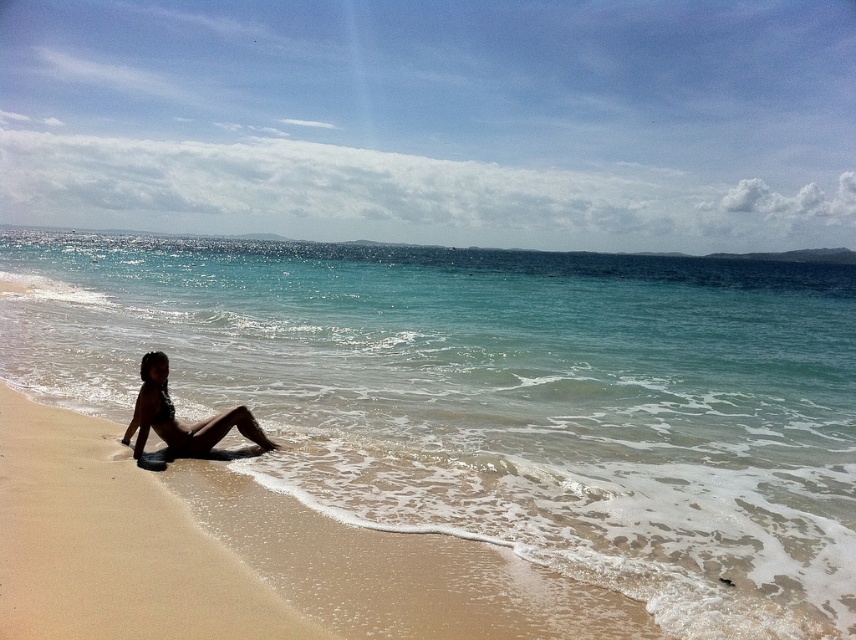
You are standing on the beach and want to place a small towel between the beige sand at lower left and the matte black bikini at lower left. Based on their positions, which object should the towel be closer to?

The beige sand at lower left is closer to the viewer than the matte black bikini at lower left, so the towel should be placed closer to the matte black bikini at lower left to be between them.